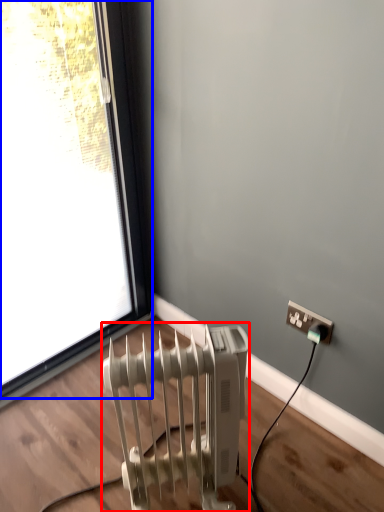
Question: Which point is further to the camera, radiator (highlighted by a red box) or window (highlighted by a blue box)?

Choices:
 (A) radiator
 (B) window

Answer: (B)